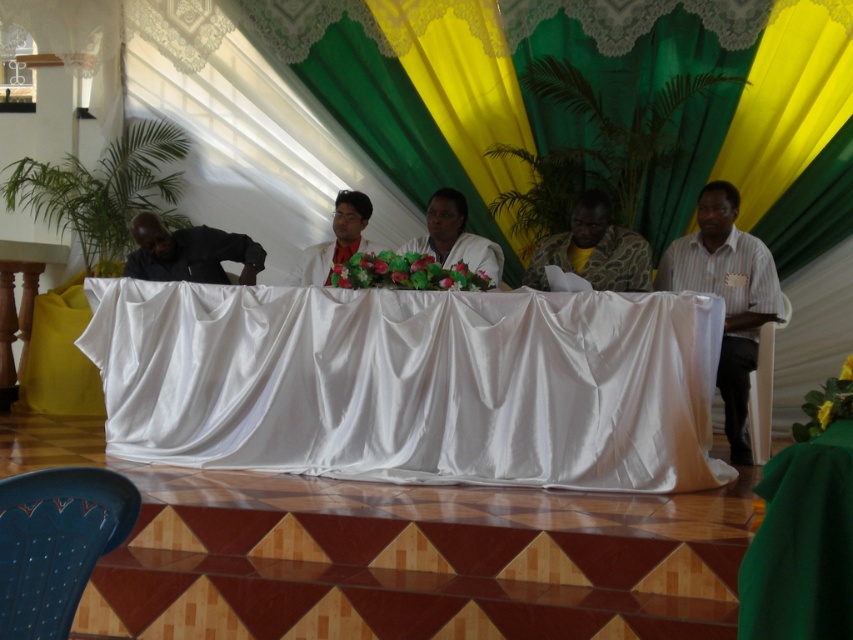
Between point (618, 291) and point (469, 234), which one is positioned in front?

Point (618, 291)

The height and width of the screenshot is (640, 853). Describe the element at coordinates (593, 250) in the screenshot. I see `snake skin shirt at center` at that location.

Does point (581, 253) come in front of point (434, 192)?

Yes, it is.

Where is `snake skin shirt at center`? snake skin shirt at center is located at coordinates 593,250.

Is point (422, 244) positioned after point (315, 260)?

No.

Describe the element at coordinates (456, 237) in the screenshot. I see `white fabric at center` at that location.

Where is `white fabric at center`? The image size is (853, 640). white fabric at center is located at coordinates (456, 237).

Who is positioned more to the left, green satin tablecloth at lower right or striped cotton shirt at right?

green satin tablecloth at lower right is more to the left.

Does point (810, 461) come closer to viewer compared to point (699, 218)?

Yes, point (810, 461) is closer to viewer.

Which is behind, point (772, 595) or point (755, 346)?

Point (755, 346)

Identify the location of green satin tablecloth at lower right. The height and width of the screenshot is (640, 853). (801, 544).